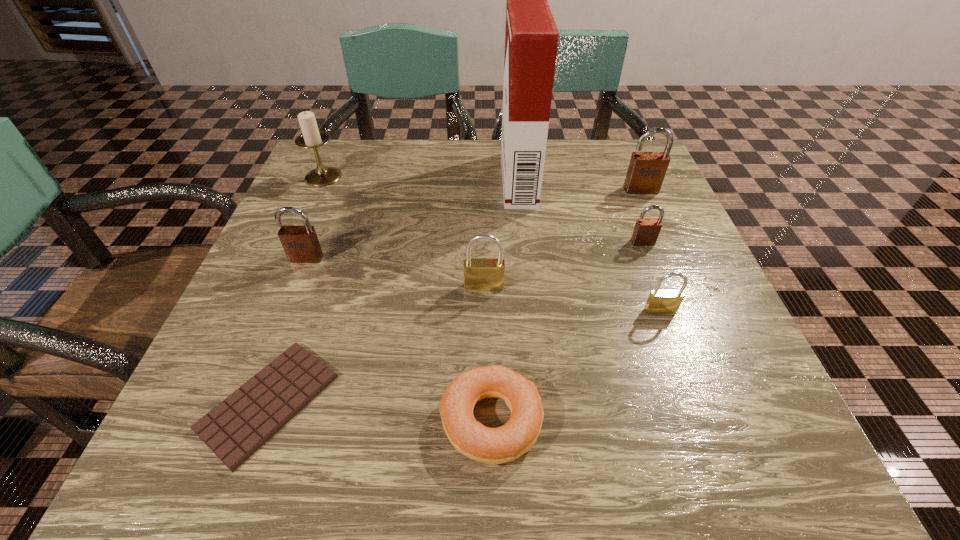
You are a GUI agent. You are given a task and a screenshot of the screen. Output one action in this format:
    pyautogui.click(x=<x>, y=<y>)
    Task: Click on the brown padlock object that ranks as the closest to the leftmost brown padlock
    
    Given the screenshot: What is the action you would take?
    pyautogui.click(x=646, y=231)

Find the location of a particular element. free spot that satisfies the following two spatial constraints: 1. on the front-facing side of the red cigarette_case; 2. on the front-facing side of the fourth padlock from right to left is located at coordinates (530, 287).